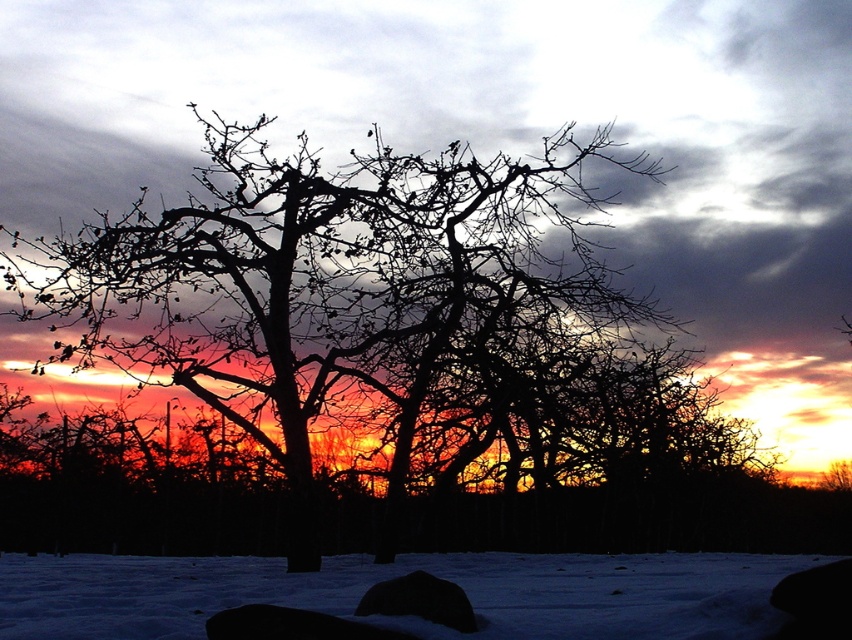
You are standing in the snowy winter scene and want to place a small red ornament on the ground near the black silhouette tree at center. Where should you place it so that it is visible above the white powdery snow at lower center?

The black silhouette tree at center is above the white powdery snow at lower center, so placing the ornament near the base of the tree would ensure it sits on the snow and remains visible.

You are standing at the edge of the snowy ground and want to take a photo of the black silhouette tree at center and the white powdery snow at lower center. Which object will appear larger in the photo?

The black silhouette tree at center will appear larger in the photo because it is much taller than the white powdery snow at lower center.